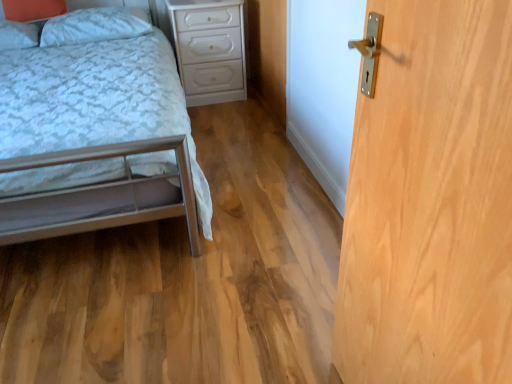
Question: Can you confirm if white glossy nightstand at center is wider than white soft pillow at upper left, the 2th pillow positioned from the left?

Choices:
 (A) yes
 (B) no

Answer: (A)

Question: Is white glossy nightstand at center directly adjacent to white soft pillow at upper left, the 2th pillow positioned from the left?

Choices:
 (A) yes
 (B) no

Answer: (B)

Question: Is white glossy nightstand at center positioned with its back to white soft pillow at upper left, the 2th pillow positioned from the left?

Choices:
 (A) no
 (B) yes

Answer: (A)

Question: Is white glossy nightstand at center shorter than white soft pillow at upper left, the 2th pillow positioned from the left?

Choices:
 (A) no
 (B) yes

Answer: (A)

Question: Can you confirm if white glossy nightstand at center is positioned to the left of white soft pillow at upper left, the 2th pillow positioned from the left?

Choices:
 (A) no
 (B) yes

Answer: (A)

Question: From a real-world perspective, is matte white pillow at upper left, placed as the 1th pillow when sorted from left to right, positioned above or below light wood/texture door at right?

Choices:
 (A) below
 (B) above

Answer: (B)

Question: Based on their sizes in the image, would you say matte white pillow at upper left, arranged as the second pillow when viewed from the right, is bigger or smaller than light wood/texture door at right?

Choices:
 (A) big
 (B) small

Answer: (B)

Question: From the image's perspective, is matte white pillow at upper left, arranged as the second pillow when viewed from the right, located above or below light wood/texture door at right?

Choices:
 (A) above
 (B) below

Answer: (A)

Question: Which is correct: matte white pillow at upper left, arranged as the second pillow when viewed from the right, is inside light wood/texture door at right, or outside of it?

Choices:
 (A) outside
 (B) inside

Answer: (A)

Question: From the image's perspective, is white soft pillow at upper left, the 2th pillow positioned from the left, located above or below white glossy nightstand at center?

Choices:
 (A) below
 (B) above

Answer: (B)

Question: In terms of width, does white soft pillow at upper left, the 2th pillow positioned from the left, look wider or thinner when compared to white glossy nightstand at center?

Choices:
 (A) thin
 (B) wide

Answer: (A)

Question: Is white soft pillow at upper left, which is the 1th pillow from right to left, inside or outside of white glossy nightstand at center?

Choices:
 (A) outside
 (B) inside

Answer: (A)

Question: In terms of height, does white soft pillow at upper left, which is the 1th pillow from right to left, look taller or shorter compared to white glossy nightstand at center?

Choices:
 (A) tall
 (B) short

Answer: (B)

Question: Would you say light wood/texture door at right is to the left or to the right of matte white pillow at upper left, placed as the 1th pillow when sorted from left to right, in the picture?

Choices:
 (A) right
 (B) left

Answer: (A)

Question: From the image's perspective, is light wood/texture door at right positioned above or below matte white pillow at upper left, placed as the 1th pillow when sorted from left to right?

Choices:
 (A) below
 (B) above

Answer: (A)